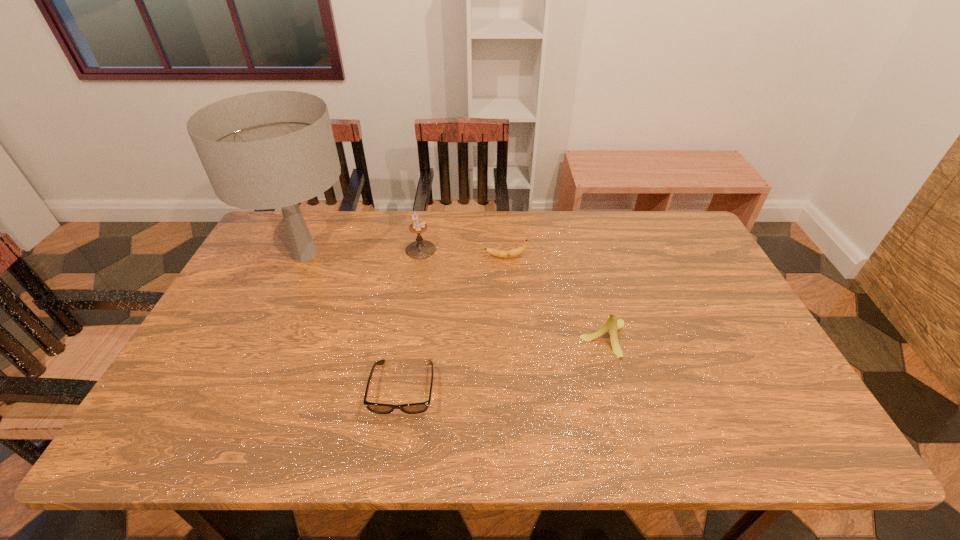
Where is `the leftmost object`? The height and width of the screenshot is (540, 960). the leftmost object is located at coordinates (272, 149).

In order to click on the tallest object in this screenshot , I will do `click(272, 149)`.

Identify the location of the second tallest object. Image resolution: width=960 pixels, height=540 pixels. (419, 249).

The height and width of the screenshot is (540, 960). I want to click on the right banana, so click(x=612, y=325).

Identify the location of the taller banana. (612, 325).

Identify the location of the fourth object from left to right. The image size is (960, 540). (514, 252).

I want to click on the left banana, so click(514, 252).

The height and width of the screenshot is (540, 960). I want to click on the nearest object, so click(414, 408).

The width and height of the screenshot is (960, 540). In order to click on the shortest object in this screenshot , I will do `click(414, 408)`.

At what (x,y) coordinates should I click in order to perform the action: click on vacant space located on the front-facing side of the lampshade. Please return your answer as a coordinate pair (x, y). Looking at the image, I should click on [254, 366].